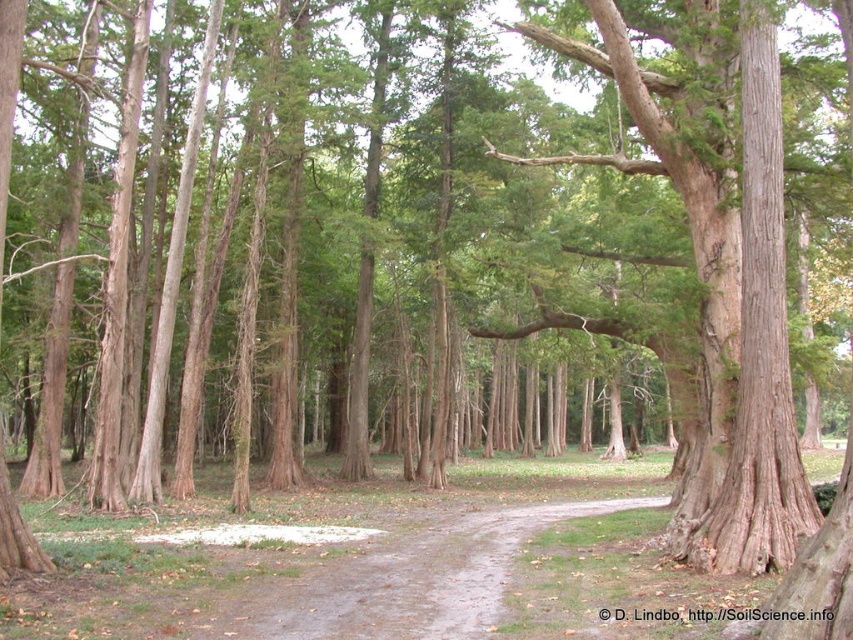
You are a hiker trying to follow the brown dirt path at center through the forest. There is a brown rough textured tree at center blocking your way. Can you walk around it without leaving the path?

The brown rough textured tree at center is larger in size than brown dirt path at center, so the path may be too narrow to go around the tree without leaving the path.

You are standing on the dirt path in the forest and see two points marked in the image. Which point is closer to you, point (805, 500) or point (471, 592)?

Point (805, 500) is closer to you because it is further to the viewer than point (471, 592).